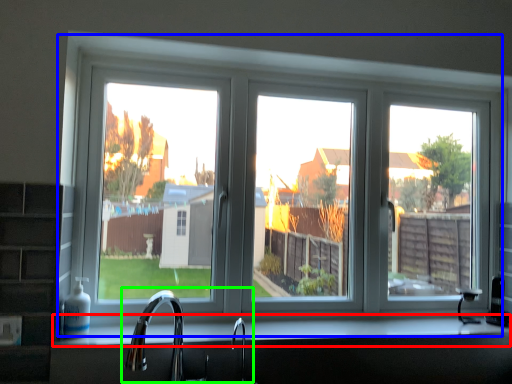
Question: Which object is the farthest from counter top (highlighted by a red box)? Choose among these: window (highlighted by a blue box) or sink (highlighted by a green box).

Choices:
 (A) window
 (B) sink

Answer: (A)